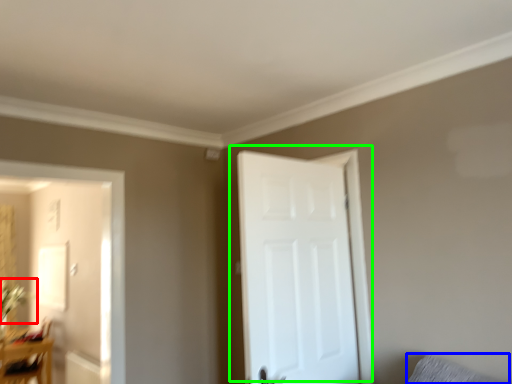
Question: Which is nearer to the plant (highlighted by a red box)? pillow (highlighted by a blue box) or door (highlighted by a green box).

Choices:
 (A) pillow
 (B) door

Answer: (B)